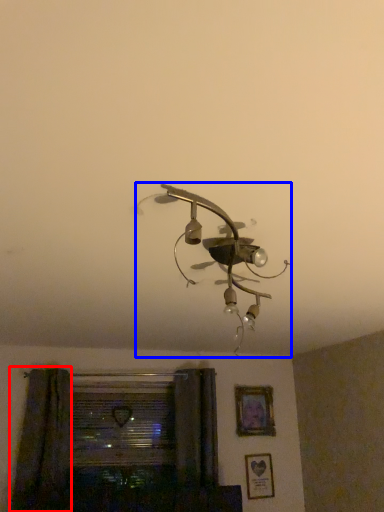
Question: Which point is further to the camera, curtain (highlighted by a red box) or lamp (highlighted by a blue box)?

Choices:
 (A) curtain
 (B) lamp

Answer: (A)